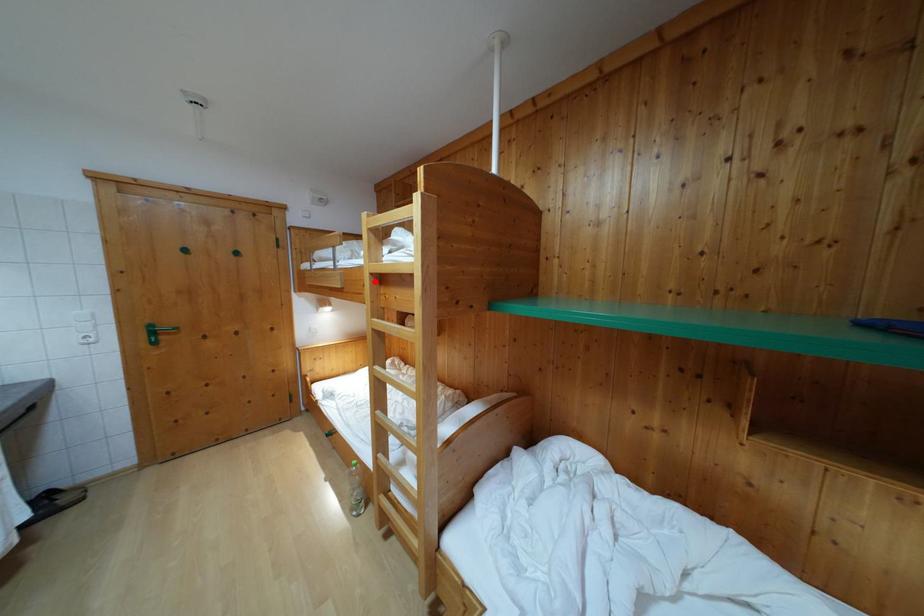
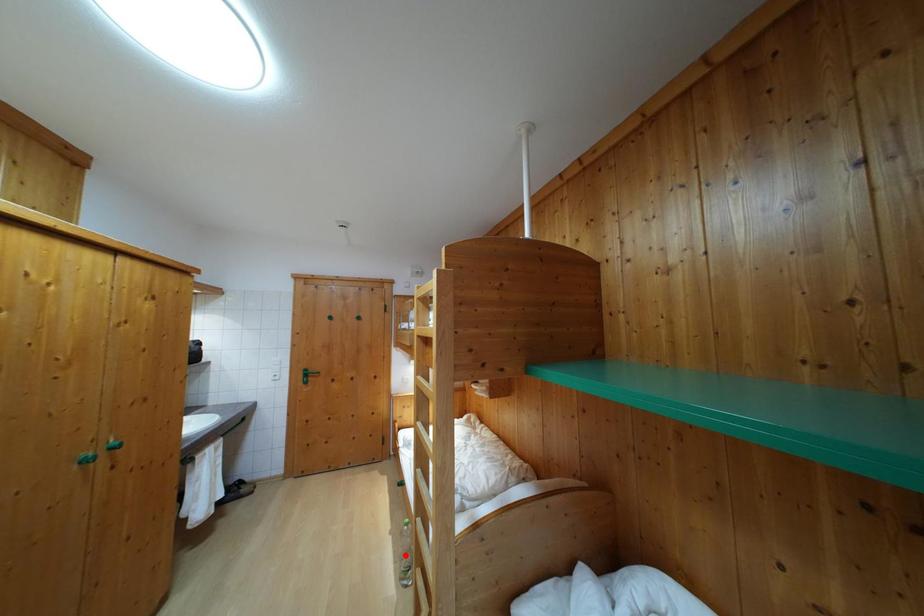
I am providing you with two images of the same scene from different viewpoints. A red point is marked on the first image and another point is marked on the second image. Are the points marked in image1 and image2 representing the same 3D position?

No